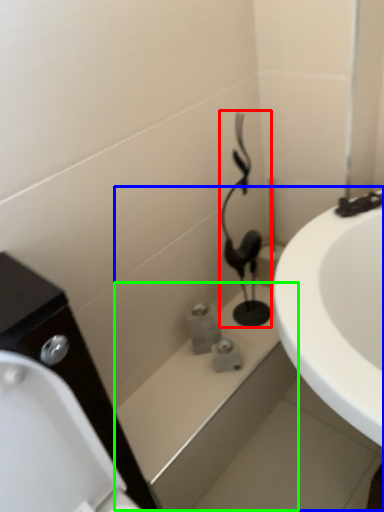
Question: Which object is the farthest from plumbing fixture (highlighted by a red box)? Choose among these: bath (highlighted by a blue box) or bath (highlighted by a green box).

Choices:
 (A) bath
 (B) bath

Answer: (B)